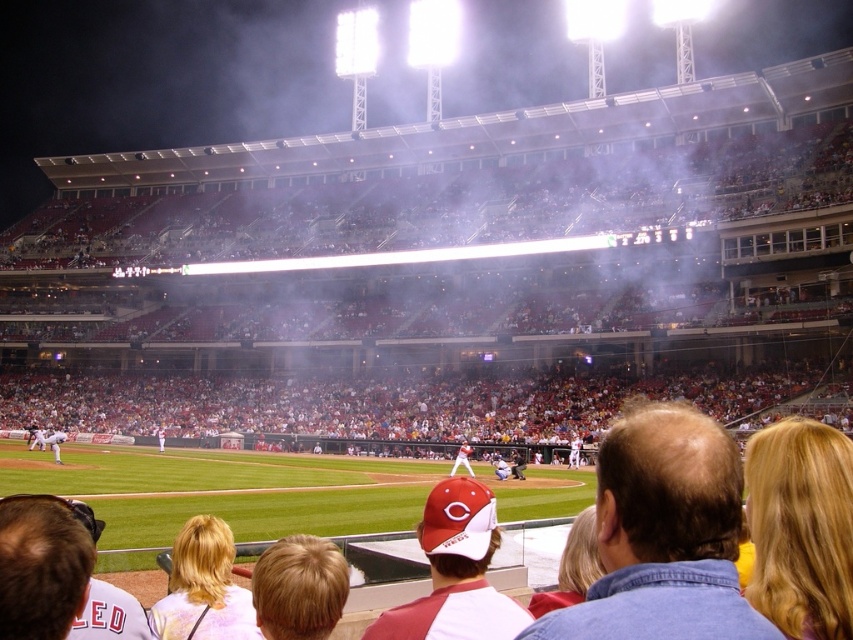
You are a photographer standing in the stands at the baseball game. You want to take a photo of the matte red cap at center without any obstructions. Considering the white plastic seats at center, will the seats block your view of the cap?

The white plastic seats at center are taller than the matte red cap at center, so they will block the view of the cap.